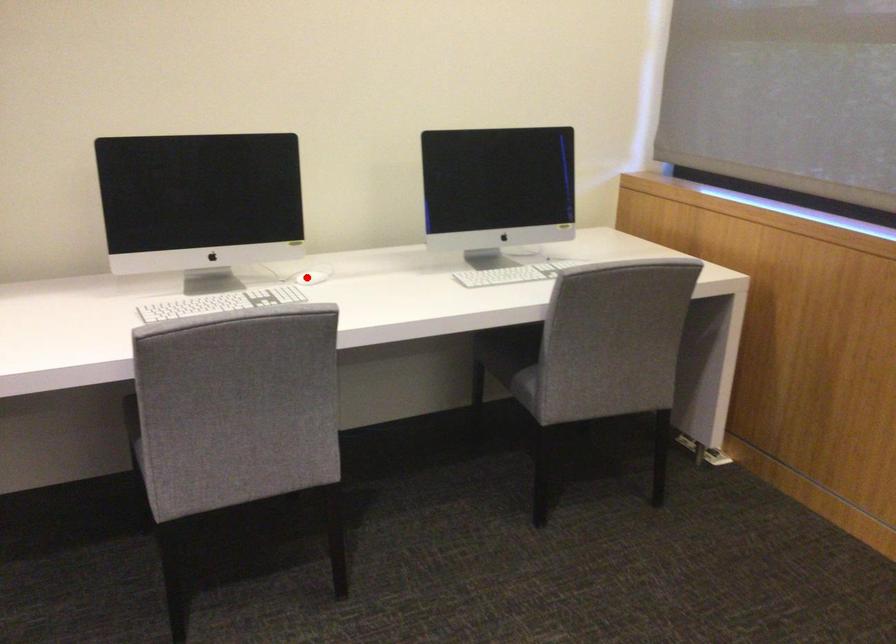
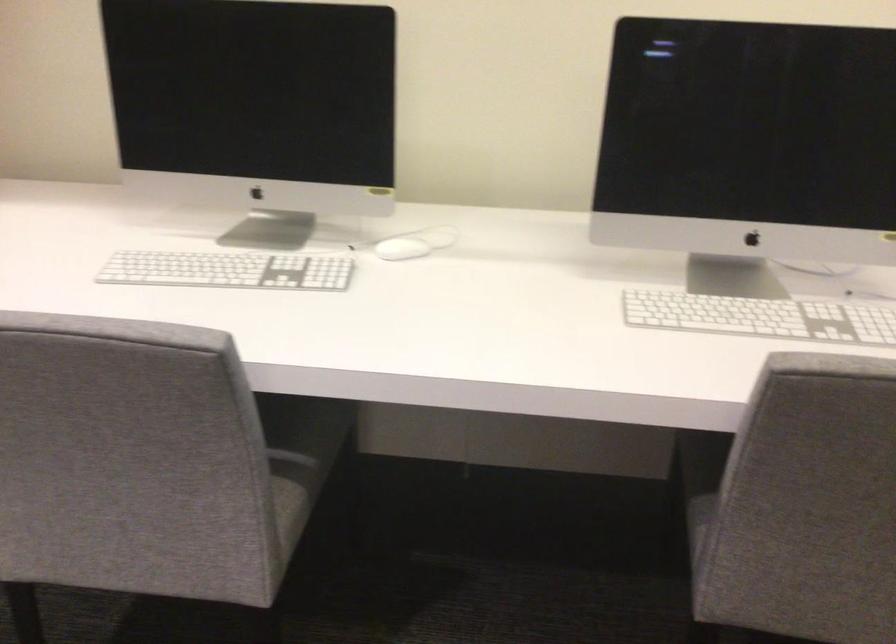
Find the pixel in the second image that matches the highlighted location in the first image.

(401, 249)